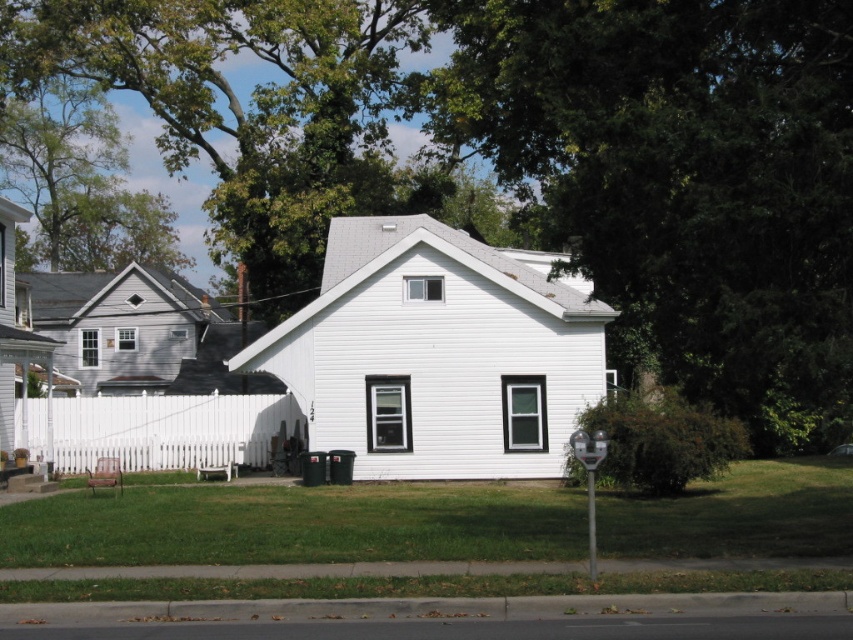
Question: Does green leafy tree at upper center have a greater width compared to white picket fence at lower left?

Choices:
 (A) no
 (B) yes

Answer: (B)

Question: Which point appears closest to the camera in this image?

Choices:
 (A) (293, 424)
 (B) (544, 141)

Answer: (A)

Question: In this image, where is green leafy tree at upper center located relative to green grass at lower center?

Choices:
 (A) left
 (B) right

Answer: (A)

Question: Observing the image, what is the correct spatial positioning of green leafy tree at upper center in reference to green grass at lower center?

Choices:
 (A) below
 (B) above

Answer: (B)

Question: Among these points, which one is farthest from the camera?

Choices:
 (A) (160, 58)
 (B) (18, 416)
 (C) (827, 481)

Answer: (A)

Question: Which of the following is the closest to the observer?

Choices:
 (A) (408, 540)
 (B) (750, 381)
 (C) (288, 396)

Answer: (B)